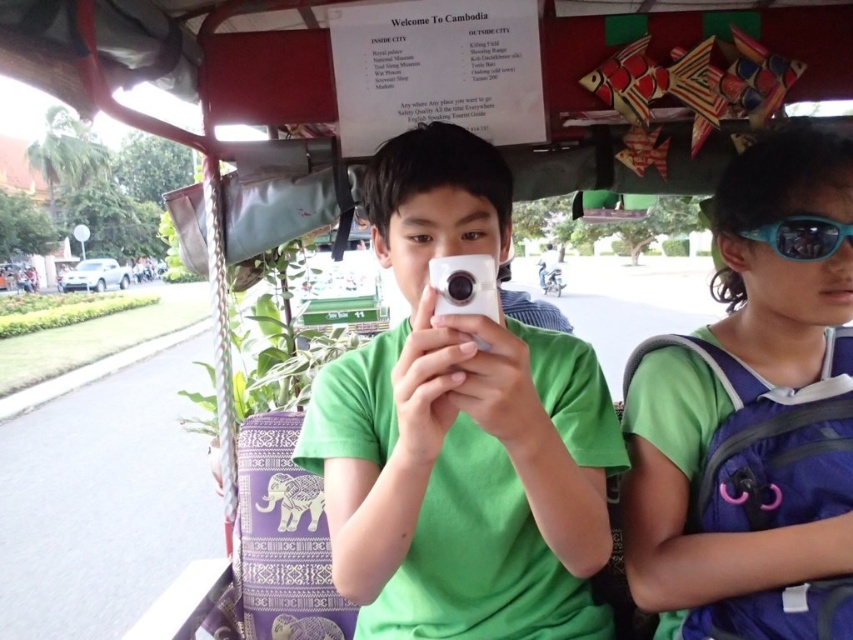
You are a passenger in the tuk tuk and want to place your sunglasses on the blue reflective lens at upper right. However, there is a green fabric backpack at center in the way. Can you move the backpack to access the lens?

The green fabric backpack at center is positioned under the blue reflective lens at upper right, so you can move the backpack to access the lens.

You are a tourist in Cambodia and you see the green matte shirt at center and the white plastic camera at center inside the tuk tuk. Which object is closer to the left side of the vehicle?

The green matte shirt at center is closer to the left side of the vehicle because it is to the left of the white plastic camera at center.